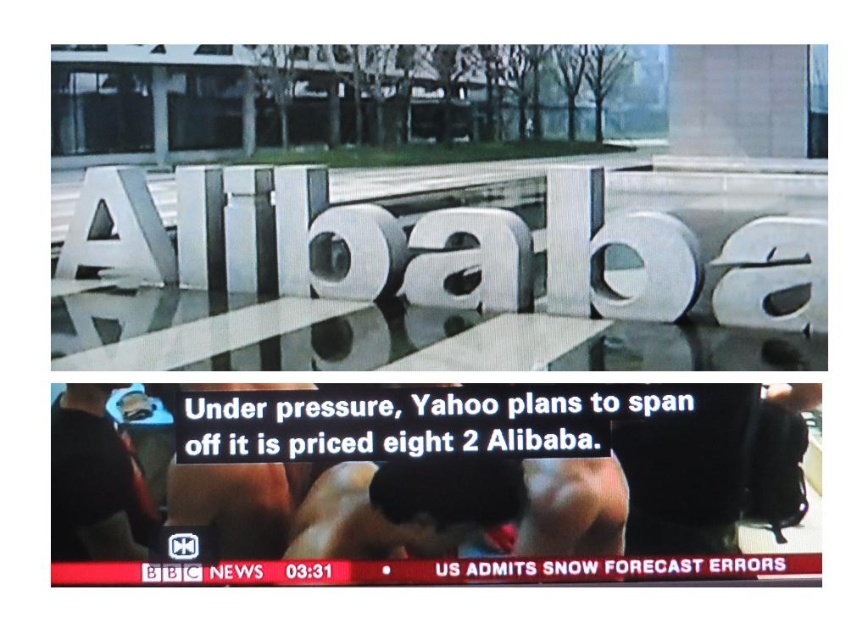
In the scene shown: Can you confirm if skinny white skin at center is positioned to the left of muscle at center?

Indeed, skinny white skin at center is positioned on the left side of muscle at center.

Who is more distant from viewer, [286,536] or [553,486]?

Point [286,536]

Measure the distance between skinny white skin at center and camera.

A distance of 12.63 feet exists between skinny white skin at center and camera.

In order to click on skinny white skin at center in this screenshot , I will do `click(237, 502)`.

Between point (367, 547) and point (229, 552), which one is positioned behind?

Point (229, 552)

Can you confirm if smooth skin squat at center is shorter than skinny white skin at center?

Indeed, smooth skin squat at center has a lesser height compared to skinny white skin at center.

I want to click on smooth skin squat at center, so click(x=404, y=508).

Who is positioned more to the right, smooth skin squat at center or black matte shirt at lower left?

From the viewer's perspective, smooth skin squat at center appears more on the right side.

Can you confirm if smooth skin squat at center is positioned to the left of black matte shirt at lower left?

In fact, smooth skin squat at center is to the right of black matte shirt at lower left.

At what (x,y) coordinates should I click in order to perform the action: click on smooth skin squat at center. Please return your answer as a coordinate pair (x, y). Image resolution: width=868 pixels, height=640 pixels. Looking at the image, I should click on (404, 508).